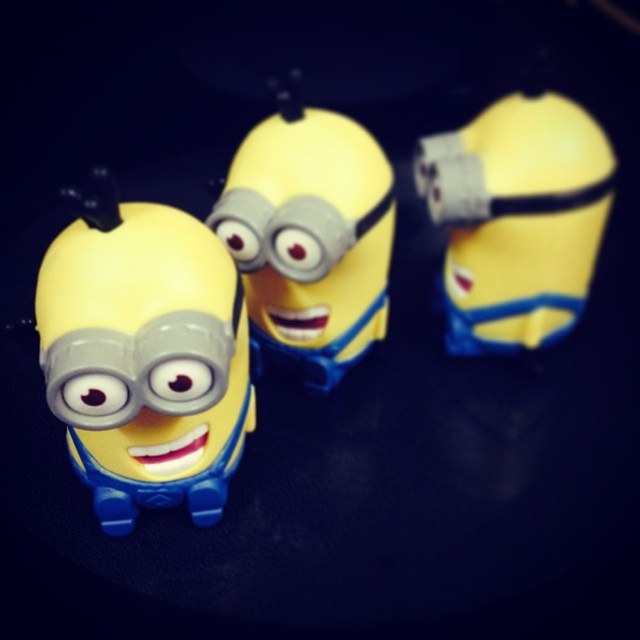
Question: Is matte plastic minion at left thinner than yellow matte toy at upper right?

Choices:
 (A) yes
 (B) no

Answer: (A)

Question: In this image, where is matte plastic minion at left located relative to matte plastic minion at center?

Choices:
 (A) above
 (B) below

Answer: (B)

Question: Which of the following is the farthest from the observer?

Choices:
 (A) matte plastic minion at center
 (B) yellow matte toy at upper right

Answer: (B)

Question: Which of the following is the closest to the observer?

Choices:
 (A) pyautogui.click(x=77, y=204)
 (B) pyautogui.click(x=509, y=102)

Answer: (A)

Question: Which object appears closest to the camera in this image?

Choices:
 (A) yellow matte toy at upper right
 (B) matte plastic minion at center

Answer: (B)

Question: Does matte plastic minion at left have a lesser width compared to matte plastic minion at center?

Choices:
 (A) yes
 (B) no

Answer: (A)